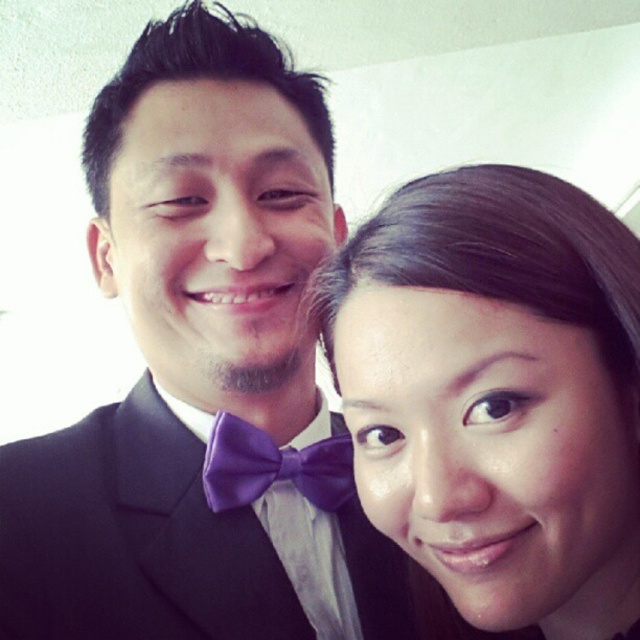
Who is higher up, smooth skin face at right or matte black suit at center?

smooth skin face at right is above.

Does point (625, 380) come in front of point (49, 572)?

That is True.

Locate an element on the screen. The width and height of the screenshot is (640, 640). smooth skin face at right is located at coordinates (496, 400).

Does smooth skin face at right have a greater width compared to purple satin bow tie at center?

Yes.

Does smooth skin face at right appear under purple satin bow tie at center?

No.

Identify the location of smooth skin face at right. (496, 400).

This screenshot has height=640, width=640. What do you see at coordinates (131, 538) in the screenshot? I see `matte black suit at center` at bounding box center [131, 538].

Who is more distant from viewer, (26, 621) or (236, 490)?

The point (236, 490) is behind.

Between point (161, 538) and point (308, 481), which one is positioned in front?

Point (161, 538) is more forward.

Identify the location of matte black suit at center. (131, 538).